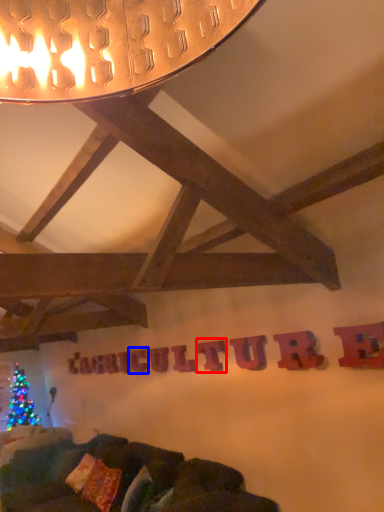
Question: Among these objects, which one is farthest to the camera, letter (highlighted by a red box) or letter (highlighted by a blue box)?

Choices:
 (A) letter
 (B) letter

Answer: (B)